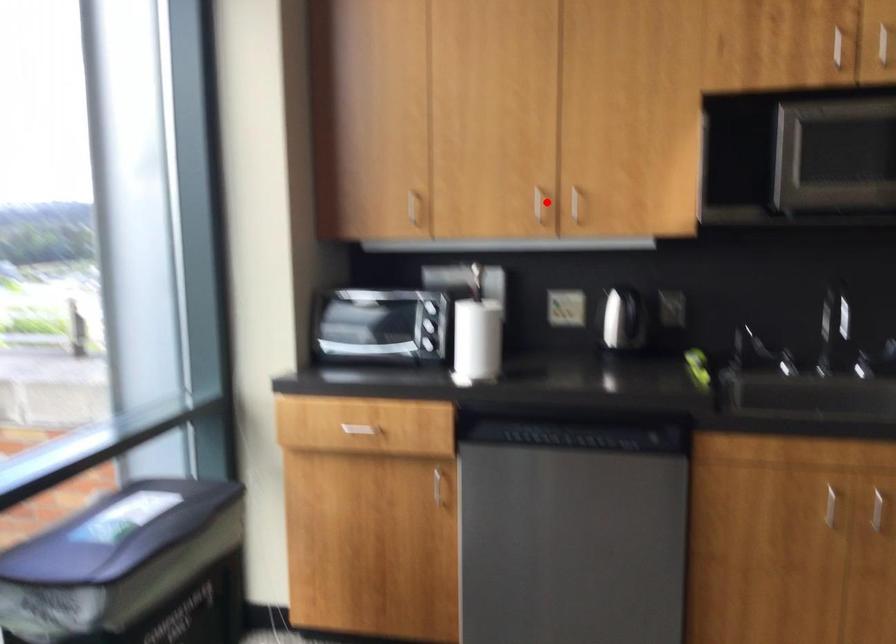
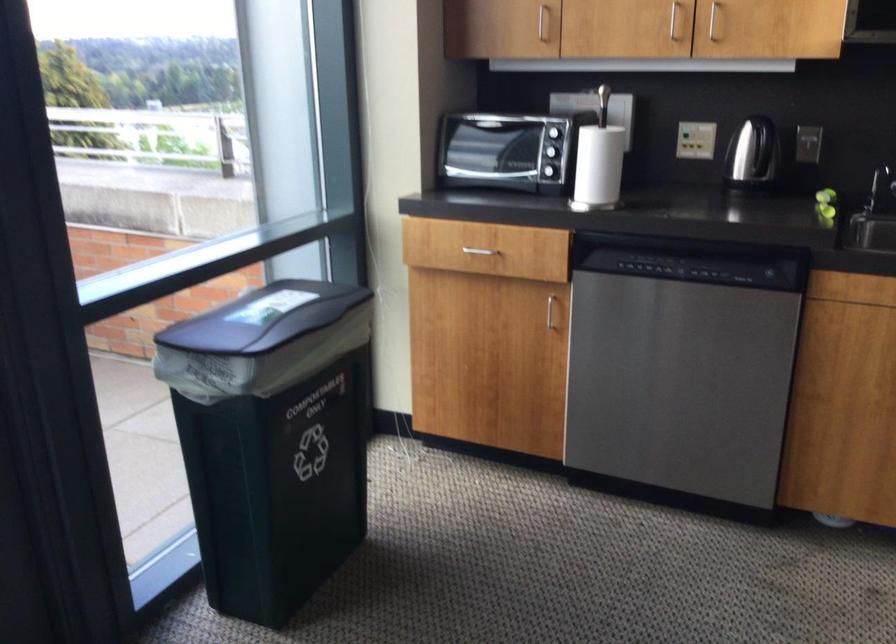
Locate, in the second image, the point that corresponds to the highlighted location in the first image.

(673, 20)